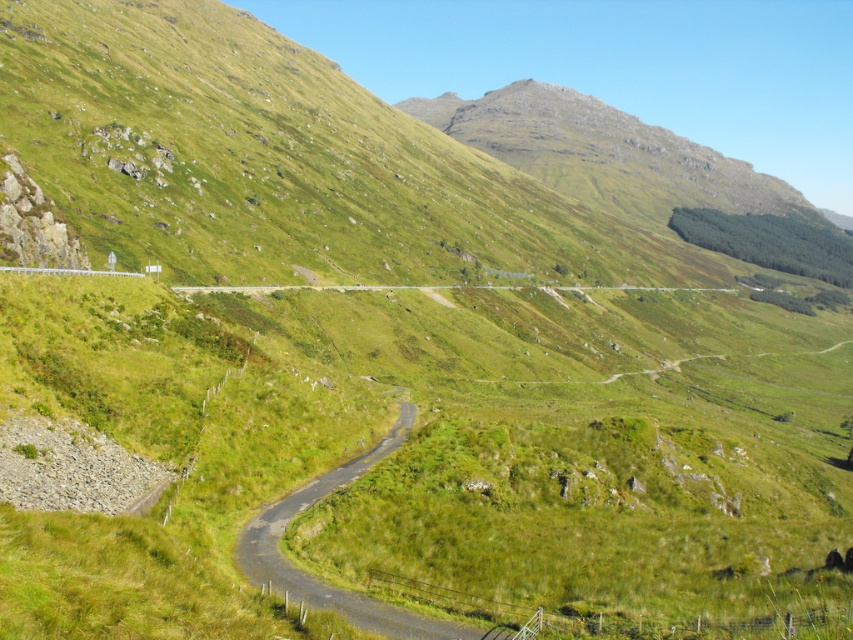
Is point (590, 179) closer to camera compared to point (300, 589)?

No, it is not.

Which of these two, green grassy mountain at upper center or green asphalt road at center, stands taller?

With more height is green grassy mountain at upper center.

In the scene shown: Measure the distance between green grassy mountain at upper center and camera.

394.53 meters

The height and width of the screenshot is (640, 853). What are the coordinates of `green grassy mountain at upper center` in the screenshot? It's located at (602, 154).